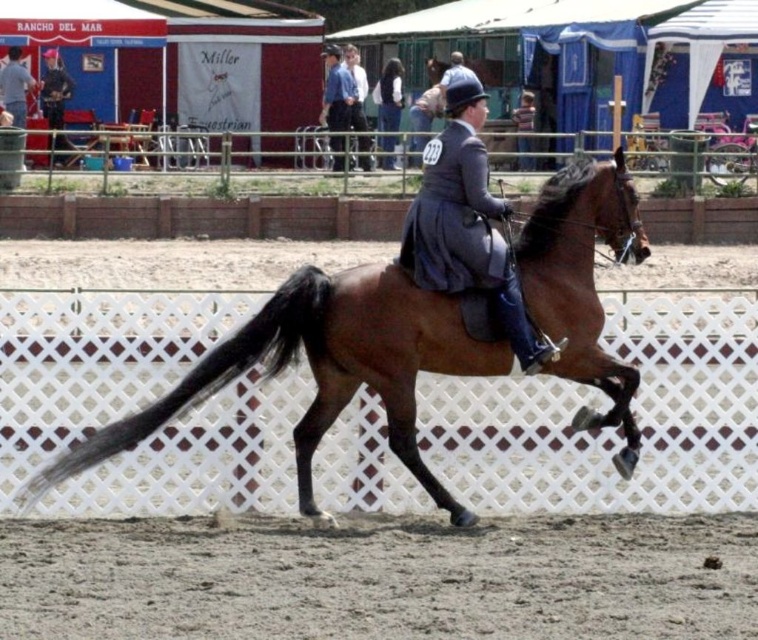
Who is positioned more to the left, brown glossy horse at center or matte gray suit at center?

brown glossy horse at center is more to the left.

Is point (180, 380) in front of point (528, 340)?

Yes.

What are the coordinates of `brown glossy horse at center` in the screenshot? It's located at click(321, 369).

Which is behind, point (625, 205) or point (340, 70)?

The point (340, 70) is more distant.

The width and height of the screenshot is (758, 640). In order to click on brown glossy horse at center in this screenshot , I will do `click(321, 369)`.

Does brown sandy dirt at lower center have a smaller size compared to blue cotton shirt at upper center?

Correct, brown sandy dirt at lower center occupies less space than blue cotton shirt at upper center.

Can you confirm if brown sandy dirt at lower center is positioned above blue cotton shirt at upper center?

Actually, brown sandy dirt at lower center is below blue cotton shirt at upper center.

I want to click on brown sandy dirt at lower center, so click(381, 577).